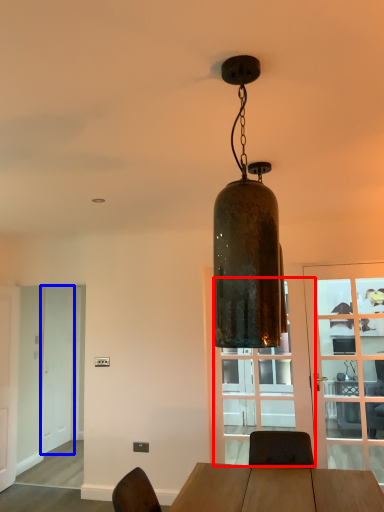
Question: Which object appears closest to the camera in this image, glass door (highlighted by a red box) or screen door (highlighted by a blue box)?

Choices:
 (A) glass door
 (B) screen door

Answer: (A)